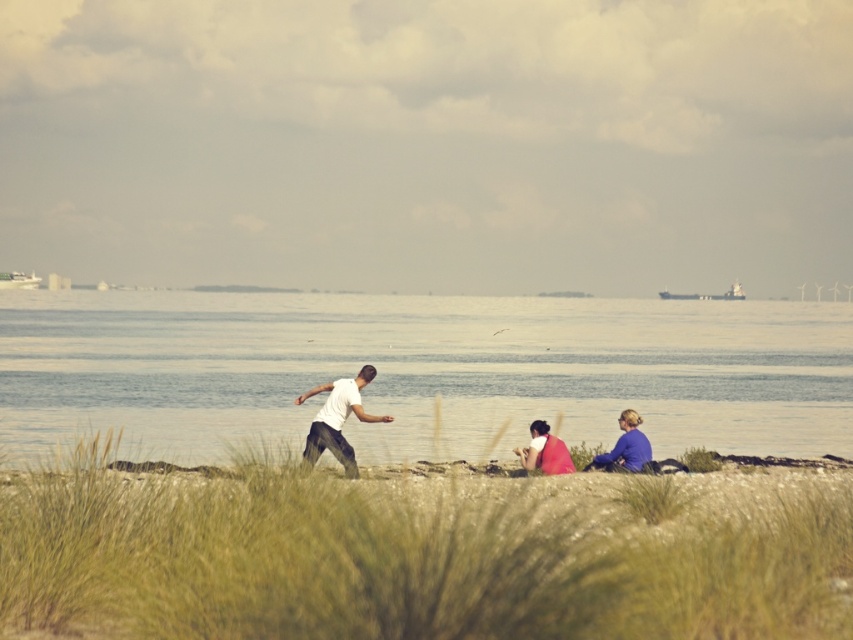
In the scene shown: You are standing at the point marked as point (415, 561) in the image. What is the name of the location you are currently standing on?

The location at point (415, 561) is the grassy sand at center.

You are a photographer planning to capture a wide shot of the coastal scene. You notice the blue fabric at lower right and the matte red shirt at center. Which object would require more horizontal space in the frame to ensure it is fully visible?

The blue fabric at lower right requires more horizontal space in the frame because its width surpasses that of the matte red shirt at center.

From the picture: You are a photographer setting up a tripod in this coastal scene. You need to position it so that both the blue fabric at lower right and the matte red shirt at center are visible in the frame. Considering their heights, which object will appear taller in your photo?

The blue fabric at lower right will appear taller in the photo because it has a greater height compared to the matte red shirt at center according to the description.